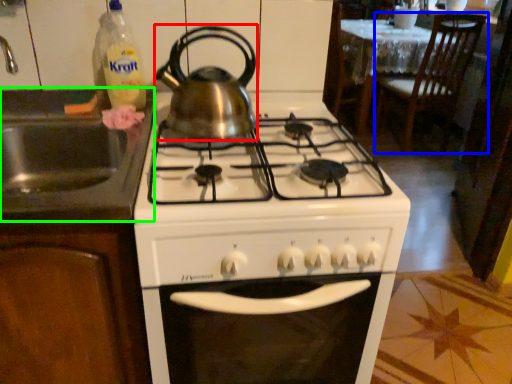
Question: Which object is positioned farthest from kitchen appliance (highlighted by a red box)? Select from chair (highlighted by a blue box) and sink (highlighted by a green box).

Choices:
 (A) chair
 (B) sink

Answer: (A)